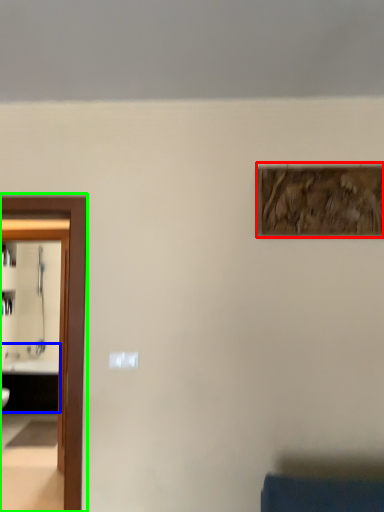
Question: Based on their relative distances, which object is farther from picture frame (highlighted by a red box)? Choose from sink (highlighted by a blue box) and elevator (highlighted by a green box).

Choices:
 (A) sink
 (B) elevator

Answer: (A)